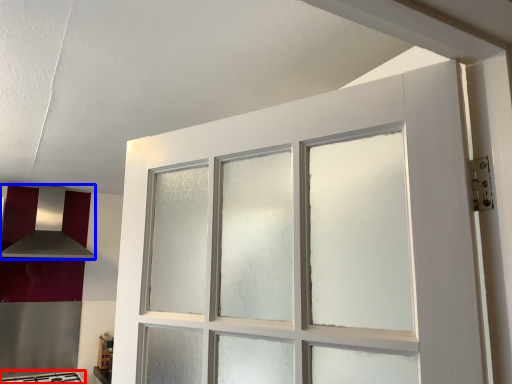
Question: Which object is further to the camera taking this photo, gas stove (highlighted by a red box) or exhaust hood (highlighted by a blue box)?

Choices:
 (A) gas stove
 (B) exhaust hood

Answer: (B)